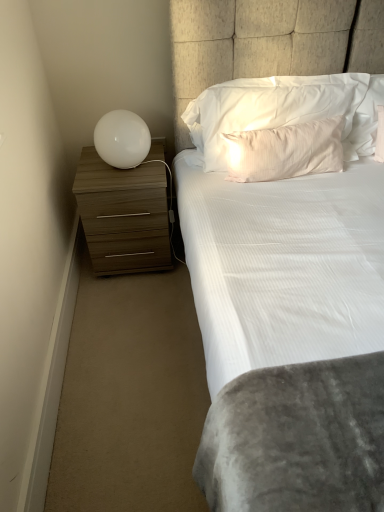
Question: Does white soft pillow at upper center, which is the 2th pillow from bottom to top, come in front of white glossy sphere at left?

Choices:
 (A) no
 (B) yes

Answer: (B)

Question: Is white soft pillow at upper center, which is the 2th pillow from bottom to top, bigger than white glossy sphere at left?

Choices:
 (A) no
 (B) yes

Answer: (B)

Question: From a real-world perspective, does white soft pillow at upper center, marked as the first pillow in a top-to-bottom arrangement, sit lower than white glossy sphere at left?

Choices:
 (A) yes
 (B) no

Answer: (B)

Question: Can you confirm if white soft pillow at upper center, marked as the first pillow in a top-to-bottom arrangement, is wider than white glossy sphere at left?

Choices:
 (A) no
 (B) yes

Answer: (A)

Question: Considering the relative positions of white soft pillow at upper center, which is the 2th pillow from bottom to top, and white glossy sphere at left in the image provided, is white soft pillow at upper center, which is the 2th pillow from bottom to top, to the left of white glossy sphere at left from the viewer's perspective?

Choices:
 (A) no
 (B) yes

Answer: (A)

Question: In the image, is white satin pillow at upper center, which is the 2th pillow from top to bottom, positioned in front of or behind white glossy sphere at left?

Choices:
 (A) behind
 (B) front

Answer: (B)

Question: Choose the correct answer: Is white satin pillow at upper center, the 1th pillow when ordered from bottom to top, inside white glossy sphere at left or outside it?

Choices:
 (A) inside
 (B) outside

Answer: (B)

Question: Does point (266, 156) appear closer or farther from the camera than point (97, 151)?

Choices:
 (A) closer
 (B) farther

Answer: (A)

Question: In terms of width, does white satin pillow at upper center, which is the 2th pillow from top to bottom, look wider or thinner when compared to white glossy sphere at left?

Choices:
 (A) thin
 (B) wide

Answer: (A)

Question: Would you say wooden chest of drawers at left is inside or outside white soft pillow at upper center, which is the 2th pillow from bottom to top?

Choices:
 (A) inside
 (B) outside

Answer: (B)

Question: From the image's perspective, relative to white soft pillow at upper center, which is the 2th pillow from bottom to top, is wooden chest of drawers at left above or below?

Choices:
 (A) below
 (B) above

Answer: (A)

Question: Is point click(x=117, y=254) positioned closer to the camera than point click(x=206, y=130)?

Choices:
 (A) farther
 (B) closer

Answer: (A)

Question: Based on their positions, is wooden chest of drawers at left located to the left or right of white soft pillow at upper center, which is the 2th pillow from bottom to top?

Choices:
 (A) right
 (B) left

Answer: (B)

Question: Considering the positions of white satin pillow at upper center, the 1th pillow when ordered from bottom to top, and wooden chest of drawers at left in the image, is white satin pillow at upper center, the 1th pillow when ordered from bottom to top, taller or shorter than wooden chest of drawers at left?

Choices:
 (A) short
 (B) tall

Answer: (A)

Question: Is white satin pillow at upper center, the 1th pillow when ordered from bottom to top, wider or thinner than wooden chest of drawers at left?

Choices:
 (A) wide
 (B) thin

Answer: (B)